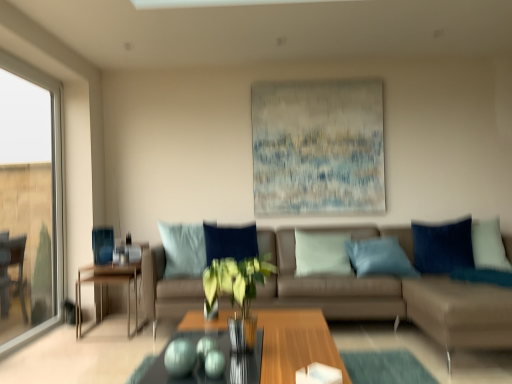
The image size is (512, 384). Describe the element at coordinates (106, 285) in the screenshot. I see `wooden table at left` at that location.

The image size is (512, 384). I want to click on green leafy plant in glass vase at center, so click(x=237, y=292).

This screenshot has width=512, height=384. What do you see at coordinates (29, 202) in the screenshot?
I see `transparent glass window at left` at bounding box center [29, 202].

What do you see at coordinates (392, 299) in the screenshot? I see `suede beige couch at center` at bounding box center [392, 299].

Identify the location of wooden table at left. This screenshot has width=512, height=384. (106, 285).

Is suede beige couch at center facing away from wooden table at left?

That's not correct — suede beige couch at center is not looking away from wooden table at left.

Which object is further away from the camera taking this photo, suede beige couch at center or wooden table at left?

wooden table at left is further from the camera.

This screenshot has height=384, width=512. In order to click on table lying behind the suede beige couch at center in this screenshot , I will do `click(106, 285)`.

From the image's perspective, who appears lower, suede beige couch at center or wooden table at left?

wooden table at left appears lower in the image.

Are suede beige couch at center and green leafy plant in glass vase at center making contact?

No, suede beige couch at center is not beside green leafy plant in glass vase at center.

Does suede beige couch at center come behind green leafy plant in glass vase at center?

Yes, it is.

Considering the relative sizes of suede beige couch at center and green leafy plant in glass vase at center in the image provided, is suede beige couch at center thinner than green leafy plant in glass vase at center?

In fact, suede beige couch at center might be wider than green leafy plant in glass vase at center.

Image resolution: width=512 pixels, height=384 pixels. In order to click on studio couch lying on the right of textured canvas painting at upper center in this screenshot , I will do `click(392, 299)`.

Considering the relative positions of textured canvas painting at upper center and suede beige couch at center in the image provided, is textured canvas painting at upper center behind suede beige couch at center?

Yes, it is.

Does textured canvas painting at upper center have a greater width compared to suede beige couch at center?

No, textured canvas painting at upper center is not wider than suede beige couch at center.

Can you tell me how much wooden coffee table at center and textured canvas painting at upper center differ in facing direction?

90.9 degrees separate the facing orientations of wooden coffee table at center and textured canvas painting at upper center.

Is the depth of wooden coffee table at center less than that of textured canvas painting at upper center?

Yes, wooden coffee table at center is closer to the camera.

Can you confirm if wooden coffee table at center is taller than textured canvas painting at upper center?

No.

Are wooden coffee table at center and textured canvas painting at upper center located far from each other?

Yes.

From a real-world perspective, does velvet blue pillow at right stand above textured canvas painting at upper center?

No, from a real-world perspective, velvet blue pillow at right is not on top of textured canvas painting at upper center.

Which of these two, velvet blue pillow at right or textured canvas painting at upper center, is bigger?

Bigger between the two is textured canvas painting at upper center.

Is velvet blue pillow at right inside the boundaries of textured canvas painting at upper center, or outside?

velvet blue pillow at right is located beyond the bounds of textured canvas painting at upper center.

Is wooden coffee table at center not inside suede beige couch at center?

That's correct, wooden coffee table at center is outside of suede beige couch at center.

Who is taller, wooden coffee table at center or suede beige couch at center?

Standing taller between the two is suede beige couch at center.

Which is less distant, (290,333) or (147,252)?

Point (290,333).

Looking at this image, which is correct: green leafy plant in glass vase at center is inside transparent glass window at left, or outside of it?

green leafy plant in glass vase at center cannot be found inside transparent glass window at left.

Is green leafy plant in glass vase at center taller or shorter than transparent glass window at left?

Considering their sizes, green leafy plant in glass vase at center has less height than transparent glass window at left.

Does point (223, 258) come in front of point (33, 108)?

Yes.

I want to click on table directly beneath the suede beige couch at center (from a real-world perspective), so click(x=106, y=285).

You are a GUI agent. You are given a task and a screenshot of the screen. Output one action in this format:
    pyautogui.click(x=<x>, y=<y>)
    Task: Click on the houseplant that appears above the suede beige couch at center (from the image's perspective)
    This screenshot has width=512, height=384.
    Given the screenshot: What is the action you would take?
    pyautogui.click(x=237, y=292)

Based on their spatial positions, is green leafy plant in glass vase at center or velvet blue pillow at right closer to suede beige couch at center?

Among the two, velvet blue pillow at right is located nearer to suede beige couch at center.

When comparing their distances from green leafy plant in glass vase at center, does suede beige couch at center or transparent glass window at left seem closer?

Based on the image, suede beige couch at center appears to be nearer to green leafy plant in glass vase at center.

When comparing their distances from suede beige couch at center, does wooden coffee table at center or transparent glass window at left seem further?

The object further to suede beige couch at center is transparent glass window at left.

Estimate the real-world distances between objects in this image. Which object is further from textured canvas painting at upper center, suede beige couch at center or transparent glass window at left?

Among the two, transparent glass window at left is located further to textured canvas painting at upper center.

Consider the image. When comparing their distances from wooden coffee table at center, does green leafy plant in glass vase at center or textured canvas painting at upper center seem closer?

Among the two, green leafy plant in glass vase at center is located nearer to wooden coffee table at center.

From the image, which object appears to be farther from textured canvas painting at upper center, transparent glass window at left or wooden table at left?

transparent glass window at left is further to textured canvas painting at upper center.

From the image, which object appears to be farther from wooden coffee table at center, transparent glass window at left or velvet blue pillow at right?

transparent glass window at left is positioned further to the anchor wooden coffee table at center.

Based on the photo, estimate the real-world distances between objects in this image. Which object is further from textured canvas painting at upper center, suede beige couch at center or wooden table at left?

wooden table at left is further to textured canvas painting at upper center.

Find the location of `studio couch between wooden coffee table at center and textured canvas painting at upper center in the front-back direction`. studio couch between wooden coffee table at center and textured canvas painting at upper center in the front-back direction is located at coordinates (392, 299).

Locate an element on the screen. The height and width of the screenshot is (384, 512). picture frame situated between transparent glass window at left and velvet blue pillow at right from left to right is located at coordinates (318, 147).

Where is `coffee table between transparent glass window at left and velvet blue pillow at right in the horizontal direction`? The image size is (512, 384). coffee table between transparent glass window at left and velvet blue pillow at right in the horizontal direction is located at coordinates pos(295,343).

Locate an element on the screen. houseplant located between wooden table at left and suede beige couch at center in the left-right direction is located at coordinates (237, 292).